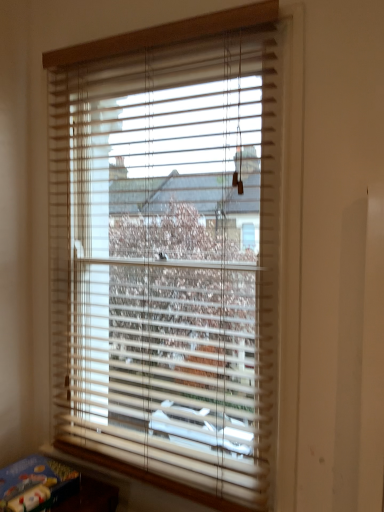
Where is `blue cardboard book at lower left`? The height and width of the screenshot is (512, 384). blue cardboard book at lower left is located at coordinates (36, 484).

Describe the element at coordinates (36, 484) in the screenshot. I see `blue cardboard book at lower left` at that location.

Measure the distance between point [0,509] and camera.

Point [0,509] is 1.30 meters away from camera.

Describe the element at coordinates (169, 254) in the screenshot. I see `wooden blinds at center` at that location.

Where is `wooden blinds at center`? The image size is (384, 512). wooden blinds at center is located at coordinates (169, 254).

Find the location of a particular element. blue cardboard book at lower left is located at coordinates (36, 484).

Can you confirm if wooden blinds at center is positioned to the right of blue cardboard book at lower left?

Yes.

Is wooden blinds at center further to camera compared to blue cardboard book at lower left?

No, wooden blinds at center is closer to the viewer.

Is point (58, 283) in front of point (4, 509)?

No, it is not.

From the image's perspective, is wooden blinds at center positioned above or below blue cardboard book at lower left?

From the image's perspective, wooden blinds at center appears above blue cardboard book at lower left.

From a real-world perspective, which is physically above, wooden blinds at center or blue cardboard book at lower left?

wooden blinds at center.

Considering the relative sizes of wooden blinds at center and blue cardboard book at lower left in the image provided, is wooden blinds at center thinner than blue cardboard book at lower left?

Indeed, wooden blinds at center has a lesser width compared to blue cardboard book at lower left.

Considering the relative sizes of wooden blinds at center and blue cardboard book at lower left in the image provided, is wooden blinds at center taller than blue cardboard book at lower left?

Indeed, wooden blinds at center has a greater height compared to blue cardboard book at lower left.

Does wooden blinds at center have a smaller size compared to blue cardboard book at lower left?

Actually, wooden blinds at center might be larger than blue cardboard book at lower left.

Is wooden blinds at center outside of blue cardboard book at lower left?

Yes, wooden blinds at center is located beyond the bounds of blue cardboard book at lower left.

Is wooden blinds at center in contact with blue cardboard book at lower left?

No, wooden blinds at center is not beside blue cardboard book at lower left.

Is wooden blinds at center facing away from blue cardboard book at lower left?

wooden blinds at center is not turned away from blue cardboard book at lower left.

Can you tell me how much wooden blinds at center and blue cardboard book at lower left differ in facing direction?

The angle between the facing direction of wooden blinds at center and the facing direction of blue cardboard book at lower left is 90 degrees.

Where is `paperback book lying below the wooden blinds at center (from the image's perspective)`? The width and height of the screenshot is (384, 512). paperback book lying below the wooden blinds at center (from the image's perspective) is located at coordinates coord(36,484).

Which object is positioned more to the left, blue cardboard book at lower left or wooden blinds at center?

Positioned to the left is blue cardboard book at lower left.

Looking at this image, is blue cardboard book at lower left further to camera compared to wooden blinds at center?

Yes.

Which is closer to the camera, (42,496) or (224,269)?

Point (42,496) is positioned closer to the camera compared to point (224,269).

From the image's perspective, which one is positioned lower, blue cardboard book at lower left or wooden blinds at center?

From the image's view, blue cardboard book at lower left is below.

From a real-world perspective, who is located higher, blue cardboard book at lower left or wooden blinds at center?

wooden blinds at center, from a real-world perspective.

Which of these two, blue cardboard book at lower left or wooden blinds at center, is wider?

Wider between the two is blue cardboard book at lower left.

Between blue cardboard book at lower left and wooden blinds at center, which one has less height?

Standing shorter between the two is blue cardboard book at lower left.

Does blue cardboard book at lower left have a smaller size compared to wooden blinds at center?

Indeed, blue cardboard book at lower left has a smaller size compared to wooden blinds at center.

Is wooden blinds at center completely or partially inside blue cardboard book at lower left?

No, wooden blinds at center is located outside of blue cardboard book at lower left.

Would you say blue cardboard book at lower left is a long distance from wooden blinds at center?

blue cardboard book at lower left is near wooden blinds at center, not far away.

Is blue cardboard book at lower left turned away from wooden blinds at center?

No.

Locate an element on the screen. Image resolution: width=384 pixels, height=512 pixels. window blind that appears on the right of blue cardboard book at lower left is located at coordinates (169, 254).

The height and width of the screenshot is (512, 384). In order to click on window blind above the blue cardboard book at lower left (from a real-world perspective) in this screenshot , I will do `click(169, 254)`.

Find the location of a particular element. The height and width of the screenshot is (512, 384). paperback book located below the wooden blinds at center (from the image's perspective) is located at coordinates (36, 484).